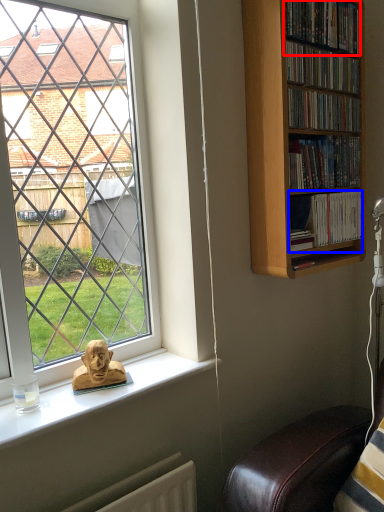
Question: Which object is further to the camera taking this photo, book (highlighted by a red box) or book (highlighted by a blue box)?

Choices:
 (A) book
 (B) book

Answer: (B)